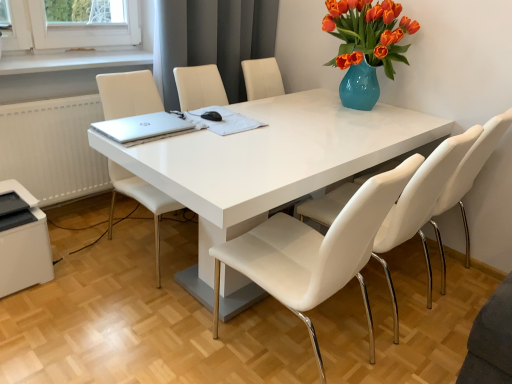
Locate an element on the screen. The image size is (512, 384). free area in between white plastic printer at lower left and white leather chair at center, which ranks as the second chair in left-to-right order is located at coordinates (124, 310).